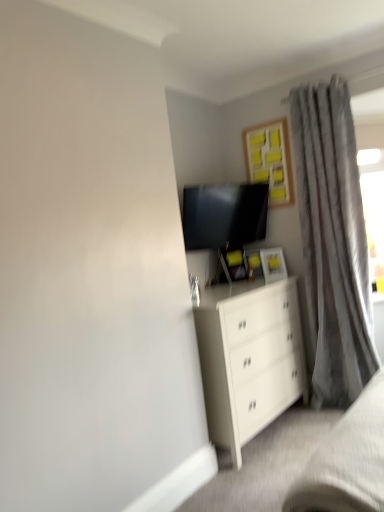
Question: Can you see wooden frame with yellow sticky notes at upper center touching matte black tv at upper center?

Choices:
 (A) yes
 (B) no

Answer: (B)

Question: Can you confirm if wooden frame with yellow sticky notes at upper center is thinner than matte black tv at upper center?

Choices:
 (A) yes
 (B) no

Answer: (A)

Question: Is wooden frame with yellow sticky notes at upper center outside of matte black tv at upper center?

Choices:
 (A) yes
 (B) no

Answer: (A)

Question: From the image's perspective, is wooden frame with yellow sticky notes at upper center on top of matte black tv at upper center?

Choices:
 (A) yes
 (B) no

Answer: (A)

Question: Can you confirm if wooden frame with yellow sticky notes at upper center is bigger than matte black tv at upper center?

Choices:
 (A) yes
 (B) no

Answer: (B)

Question: Is point (309, 460) positioned closer to the camera than point (244, 144)?

Choices:
 (A) closer
 (B) farther

Answer: (A)

Question: From the image's perspective, is white matte bed frame at lower right above or below wooden frame with yellow sticky notes at upper center?

Choices:
 (A) below
 (B) above

Answer: (A)

Question: Based on their positions, is white matte bed frame at lower right located to the left or right of wooden frame with yellow sticky notes at upper center?

Choices:
 (A) right
 (B) left

Answer: (A)

Question: From their relative heights in the image, would you say white matte bed frame at lower right is taller or shorter than wooden frame with yellow sticky notes at upper center?

Choices:
 (A) short
 (B) tall

Answer: (A)

Question: From a real-world perspective, is gray textured curtain at right positioned above or below wooden frame with yellow sticky notes at upper center?

Choices:
 (A) below
 (B) above

Answer: (A)

Question: From the image's perspective, relative to wooden frame with yellow sticky notes at upper center, is gray textured curtain at right above or below?

Choices:
 (A) below
 (B) above

Answer: (A)

Question: Is gray textured curtain at right spatially inside wooden frame with yellow sticky notes at upper center, or outside of it?

Choices:
 (A) outside
 (B) inside

Answer: (A)

Question: Is gray textured curtain at right taller or shorter than wooden frame with yellow sticky notes at upper center?

Choices:
 (A) tall
 (B) short

Answer: (A)

Question: Is point (299, 151) positioned closer to the camera than point (188, 228)?

Choices:
 (A) closer
 (B) farther

Answer: (B)

Question: Would you say gray textured curtain at right is inside or outside matte black tv at upper center?

Choices:
 (A) inside
 (B) outside

Answer: (B)